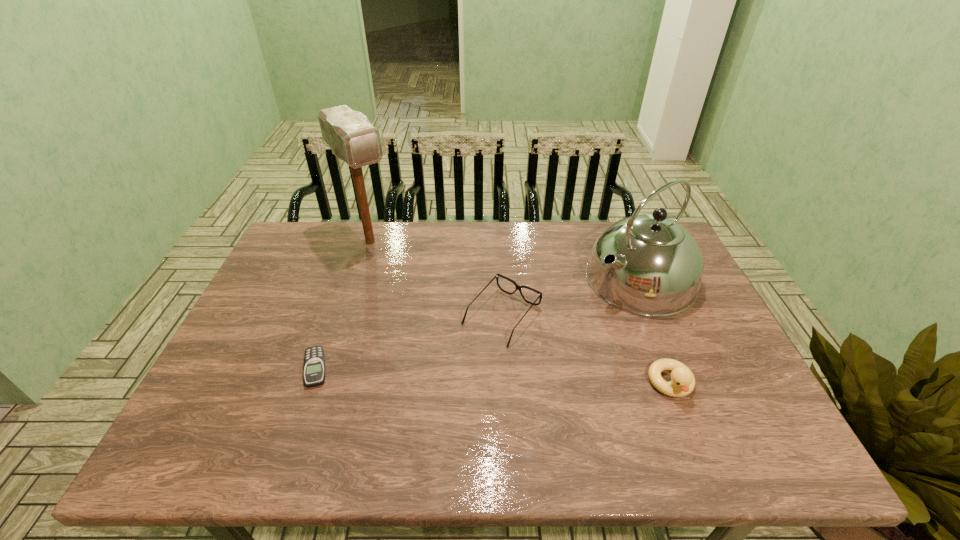
Where is `vacant space in between the fourth shortest object and the tallest object`? This screenshot has height=540, width=960. vacant space in between the fourth shortest object and the tallest object is located at coordinates (506, 260).

What are the coordinates of `free space between the second tallest object and the shortest object` in the screenshot? It's located at (478, 323).

Locate an element on the screen. The image size is (960, 540). vacant space that's between the mallet and the beeper is located at coordinates (343, 305).

Find the location of `empty space between the beeper and the fourth tallest object`. empty space between the beeper and the fourth tallest object is located at coordinates (409, 342).

Find the location of a particular element. vacant area between the mallet and the third tallest object is located at coordinates (x=520, y=313).

This screenshot has height=540, width=960. I want to click on free spot between the duckling and the beeper, so click(493, 376).

Identify the location of free space between the tallest object and the kettle. (506, 260).

You are a GUI agent. You are given a task and a screenshot of the screen. Output one action in this format:
    pyautogui.click(x=<x>, y=<y>)
    Task: Click on the unoccupied area between the third object from left to right and the duckling
    The image size is (960, 540).
    Given the screenshot: What is the action you would take?
    pyautogui.click(x=587, y=350)

At what (x,y) coordinates should I click in order to perform the action: click on free space between the mallet and the third shortest object. Please return your answer as a coordinate pair (x, y). The image size is (960, 540). Looking at the image, I should click on (520, 313).

You are a GUI agent. You are given a task and a screenshot of the screen. Output one action in this format:
    pyautogui.click(x=<x>, y=<y>)
    Task: Click on the unoccupied area between the tallest object and the beeper
    
    Given the screenshot: What is the action you would take?
    pyautogui.click(x=343, y=305)